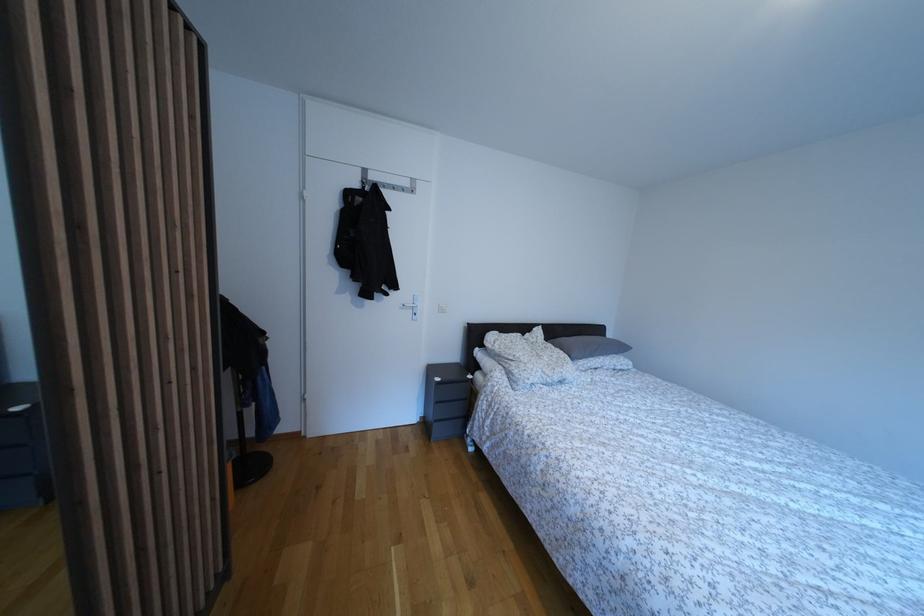
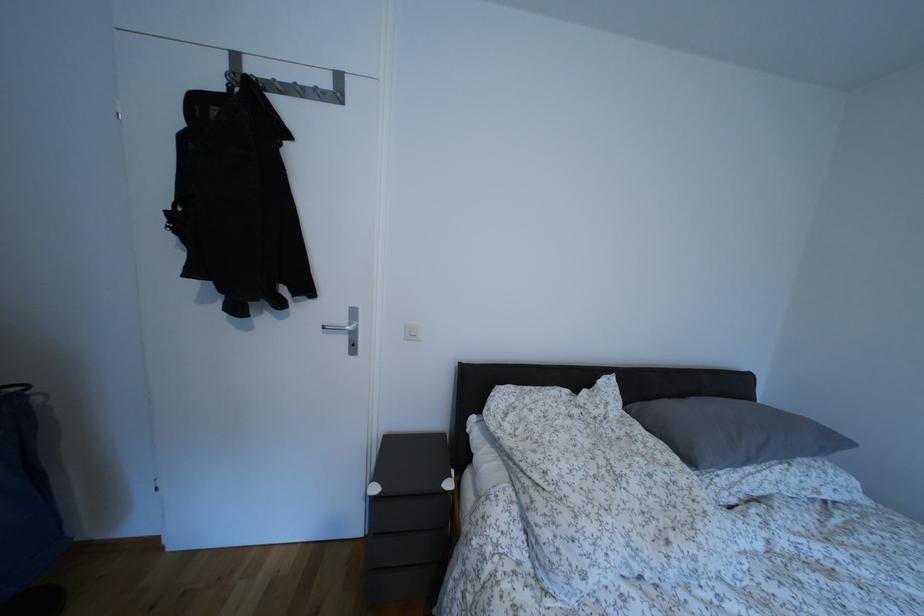
In the second image, find the point that corresponds to pixel 553 345 in the first image.

(633, 415)